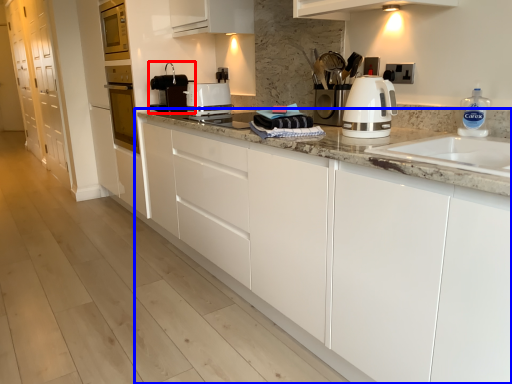
Question: Which object appears farthest to the camera in this image, home appliance (highlighted by a red box) or cabinetry (highlighted by a blue box)?

Choices:
 (A) home appliance
 (B) cabinetry

Answer: (A)